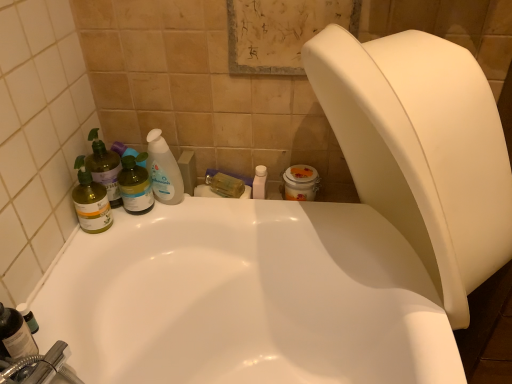
Question: Considering their positions, is translucent green bottle at left, which ranks as the 1th cleaning product in left-to-right order, located in front of or behind translucent plastic bottle at left?

Choices:
 (A) front
 (B) behind

Answer: (A)

Question: Looking at their shapes, would you say translucent green bottle at left, which is counted as the 3th cleaning product, starting from the right, is wider or thinner than translucent plastic bottle at left?

Choices:
 (A) thin
 (B) wide

Answer: (A)

Question: Considering the real-world distances, which object is closest to the white plastic bidet at upper right?

Choices:
 (A) translucent green bottle at left, which is counted as the 3th cleaning product, starting from the right
 (B) translucent plastic bottle at lower left, the 2th toiletry from the back
 (C) translucent plastic bottle at upper left, marked as the first cleaning product in a right-to-left arrangement
 (D) white glossy bottle at center, the 2th toiletry positioned from the left
 (E) translucent plastic bottle at left

Answer: (D)

Question: Which is farther from the translucent plastic bottle at left?

Choices:
 (A) translucent green bottle at left, which ranks as the 1th cleaning product in left-to-right order
 (B) white plastic bidet at upper right
 (C) white glossy bottle at center, the 2th toiletry in the bottom-to-top sequence
 (D) translucent green spray bottle at left, placed as the 2th cleaning product when sorted from left to right
 (E) translucent plastic bottle at upper left, the third cleaning product positioned from the left

Answer: (B)